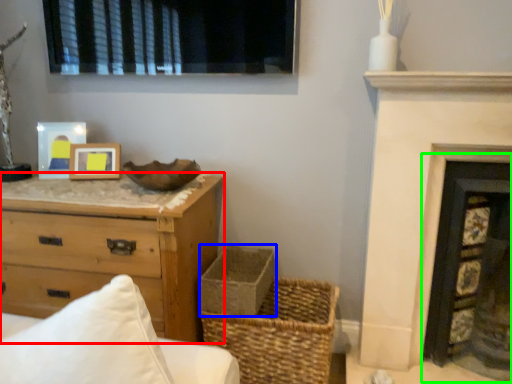
Question: Considering the real-world distances, which object is closest to chest of drawers (highlighted by a red box)? basket container (highlighted by a blue box) or fireplace (highlighted by a green box).

Choices:
 (A) basket container
 (B) fireplace

Answer: (A)